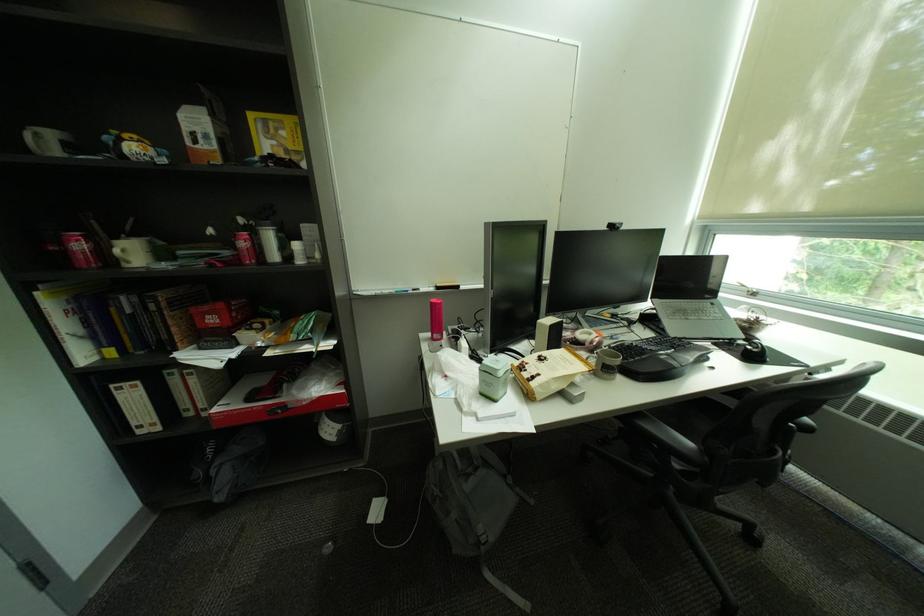
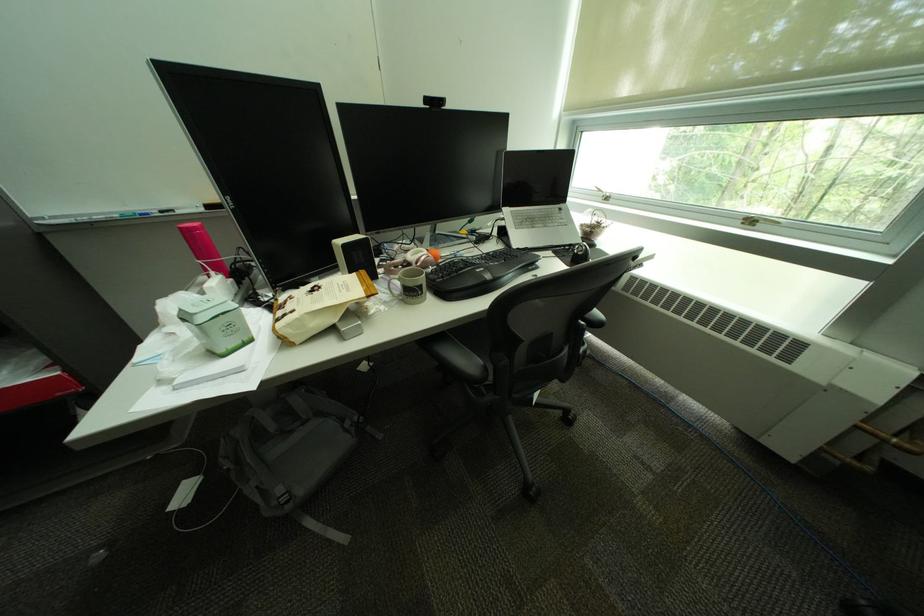
In the second image, find the point that corresponds to point 557,383 in the first image.

(309, 321)